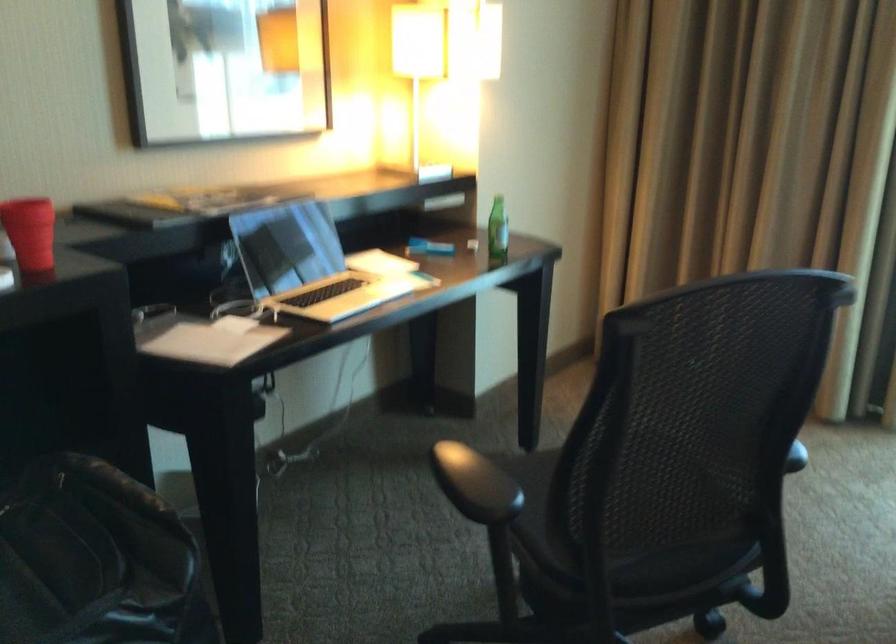
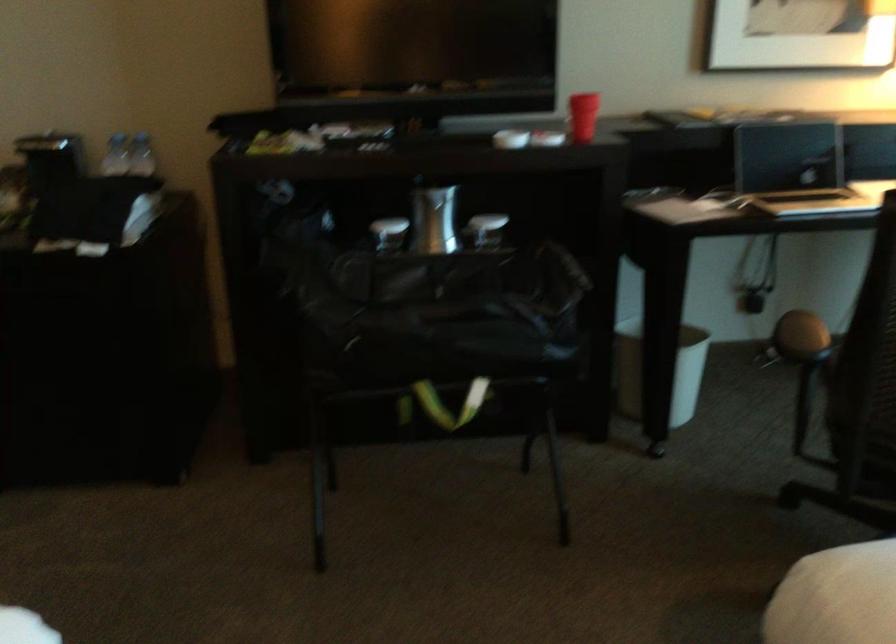
The point at (237, 567) is marked in the first image. Where is the corresponding point in the second image?

(659, 371)